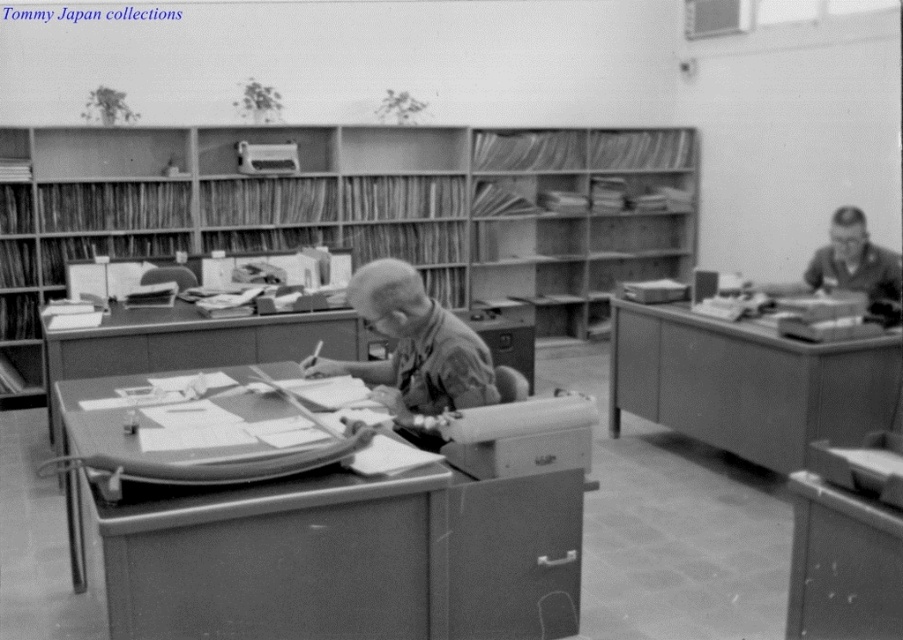
Question: Is smooth brown shirt at center to the left of matte gray uniform at right from the viewer's perspective?

Choices:
 (A) no
 (B) yes

Answer: (B)

Question: Does smooth wood table at right appear over matte gray uniform at right?

Choices:
 (A) no
 (B) yes

Answer: (A)

Question: Which point appears closest to the camera in this image?

Choices:
 (A) (864, 237)
 (B) (163, 179)

Answer: (A)

Question: Which point is closer to the camera?

Choices:
 (A) (815, 252)
 (B) (452, 362)
 (C) (789, 340)

Answer: (B)

Question: Is wooden shelves at center to the right of matte gray uniform at right from the viewer's perspective?

Choices:
 (A) yes
 (B) no

Answer: (B)

Question: Which object is closer to the camera taking this photo?

Choices:
 (A) matte gray uniform at right
 (B) smooth brown shirt at center
 (C) smooth wood table at right
 (D) wooden shelves at center

Answer: (B)